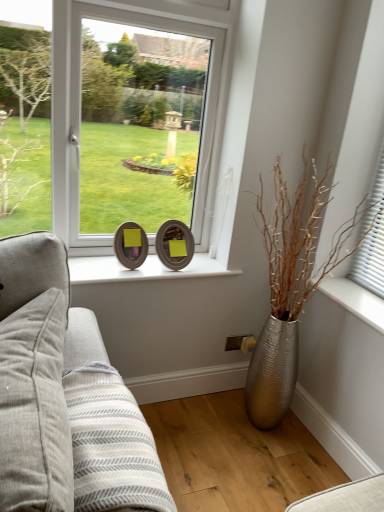
Question: Should I look upward or downward to see silver metallic vase at right?

Choices:
 (A) down
 (B) up

Answer: (A)

Question: Does silver metallic vase at right have a lesser height compared to wooden frame at center, which ranks as the second picture frame in left-to-right order?

Choices:
 (A) yes
 (B) no

Answer: (B)

Question: From a real-world perspective, is silver metallic vase at right physically above wooden frame at center, which is counted as the first picture frame, starting from the right?

Choices:
 (A) no
 (B) yes

Answer: (A)

Question: From a real-world perspective, does silver metallic vase at right sit lower than wooden frame at center, which ranks as the second picture frame in left-to-right order?

Choices:
 (A) no
 (B) yes

Answer: (B)

Question: Is silver metallic vase at right closer to camera compared to wooden frame at center, which ranks as the second picture frame in left-to-right order?

Choices:
 (A) no
 (B) yes

Answer: (B)

Question: Considering the relative positions of silver metallic vase at right and wooden frame at center, which is counted as the first picture frame, starting from the right, in the image provided, is silver metallic vase at right to the right of wooden frame at center, which is counted as the first picture frame, starting from the right, from the viewer's perspective?

Choices:
 (A) no
 (B) yes

Answer: (B)

Question: Is wooden frame at center, which is counted as the first picture frame, starting from the right, surrounded by silver metallic vase at right?

Choices:
 (A) yes
 (B) no

Answer: (B)

Question: Is silver metallic vase at right not close to gray fabric pillow at left?

Choices:
 (A) no
 (B) yes

Answer: (B)

Question: Does silver metallic vase at right appear on the right side of gray fabric pillow at left?

Choices:
 (A) no
 (B) yes

Answer: (B)

Question: Is silver metallic vase at right positioned beyond the bounds of gray fabric pillow at left?

Choices:
 (A) no
 (B) yes

Answer: (B)

Question: Is the position of silver metallic vase at right more distant than that of gray fabric pillow at left?

Choices:
 (A) yes
 (B) no

Answer: (A)

Question: Would you say gray fabric pillow at left is part of silver metallic vase at right's contents?

Choices:
 (A) yes
 (B) no

Answer: (B)

Question: From a real-world perspective, is silver metallic vase at right located higher than gray fabric pillow at left?

Choices:
 (A) no
 (B) yes

Answer: (B)

Question: Is gray fabric pillow at left far from silver metallic vase at right?

Choices:
 (A) no
 (B) yes

Answer: (B)